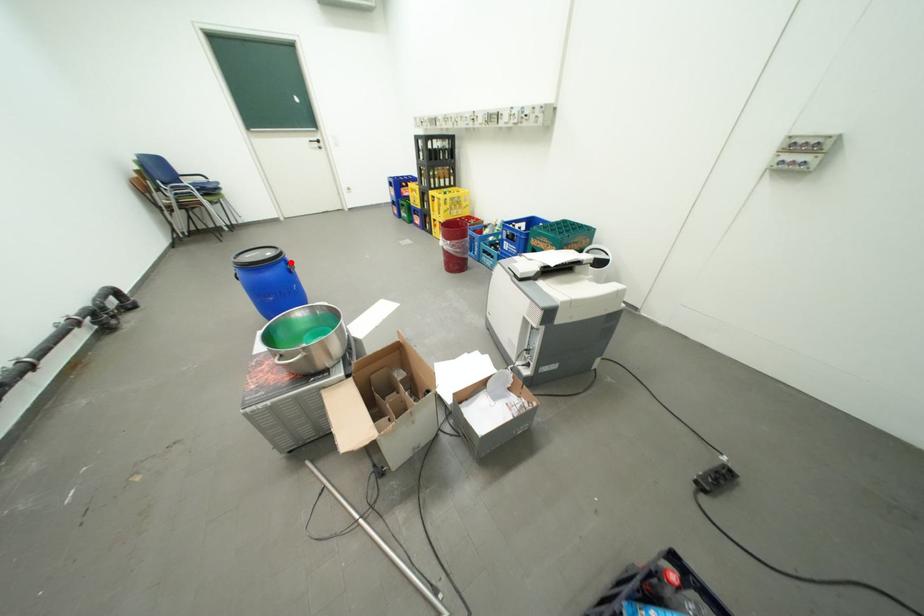
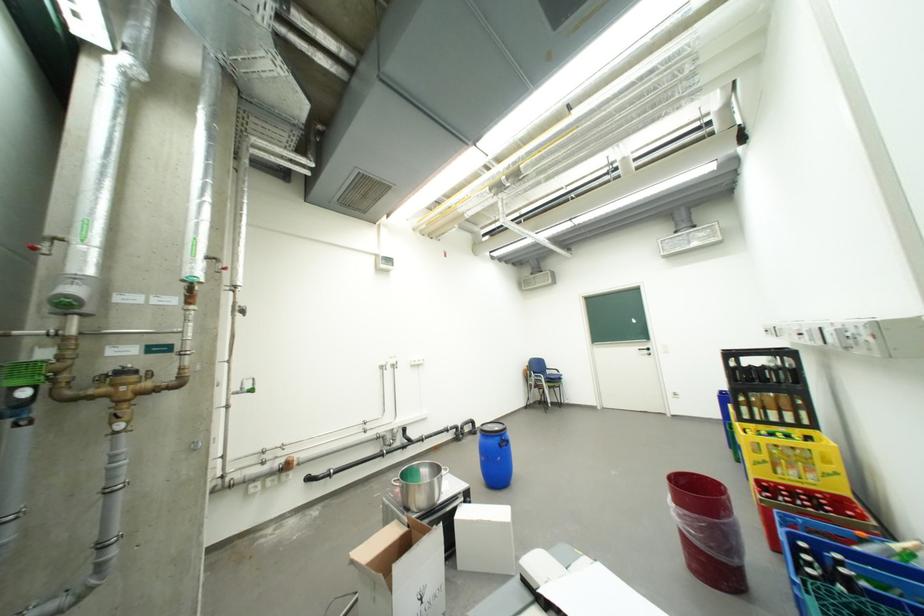
Locate, in the second image, the point that corresponds to the highlighted location in the first image.

(507, 438)